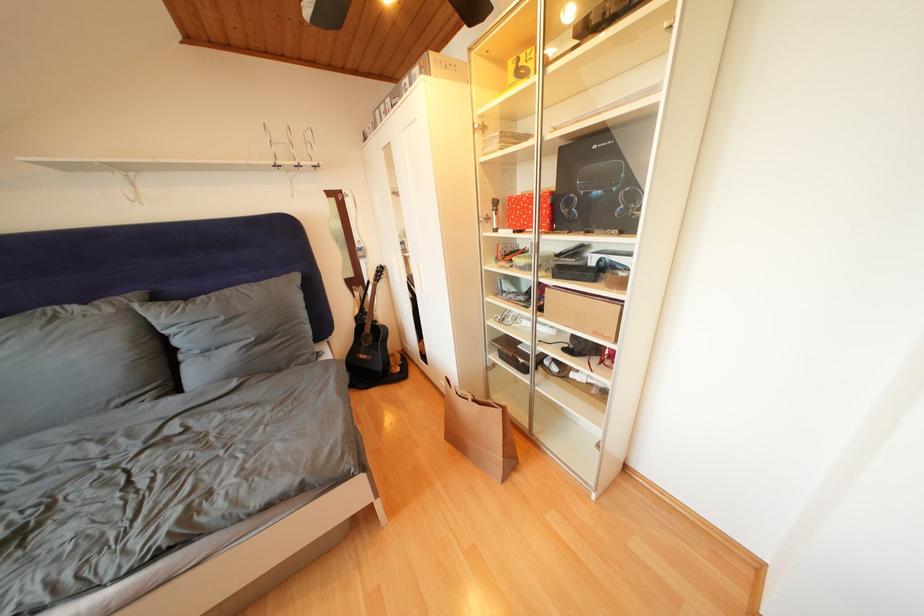
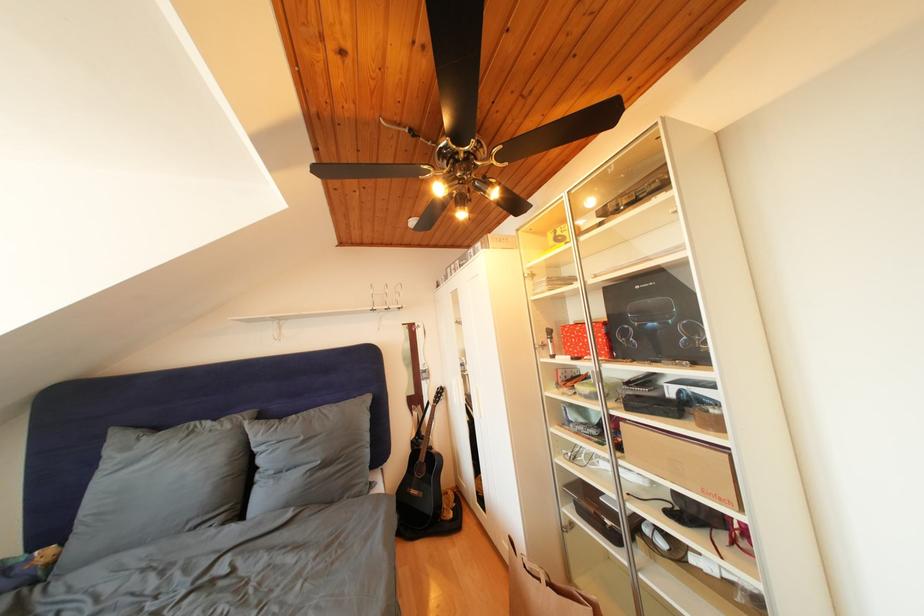
Question: Based on the continuous images, in which direction is the camera rotating? Reply with the corresponding letter.

Choices:
 (A) Left
 (B) Right
 (C) Up
 (D) Down

Answer: (C)